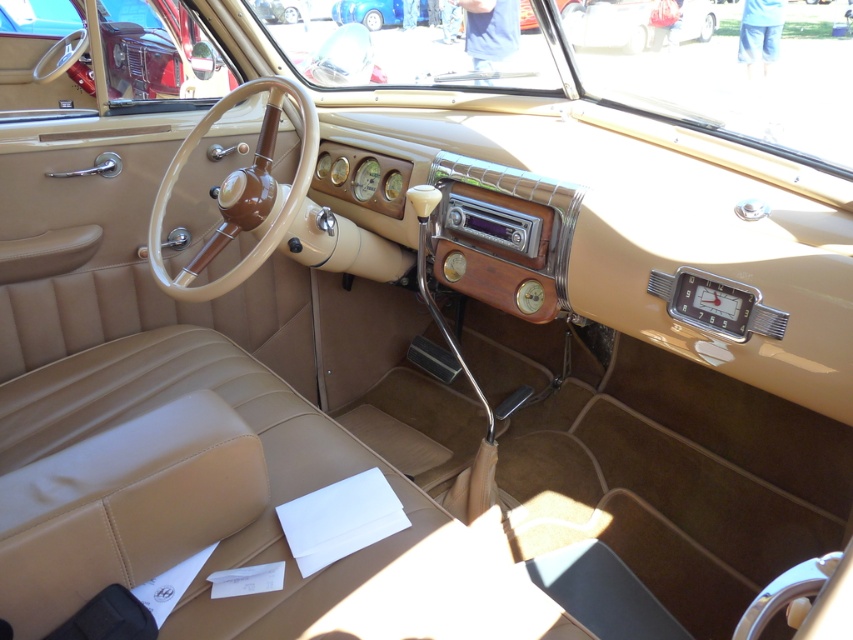
Question: Which point is farther to the camera?

Choices:
 (A) matte wood steering wheel at upper left
 (B) blue metallic car at upper center

Answer: (B)

Question: Is matte wood steering wheel at upper left to the left of blue metallic car at upper center from the viewer's perspective?

Choices:
 (A) yes
 (B) no

Answer: (A)

Question: Does matte wood steering wheel at upper left have a smaller size compared to blue metallic car at upper center?

Choices:
 (A) yes
 (B) no

Answer: (B)

Question: Does matte wood steering wheel at upper left appear on the right side of blue metallic car at upper center?

Choices:
 (A) yes
 (B) no

Answer: (B)

Question: Which point is farther from the camera taking this photo?

Choices:
 (A) (363, 19)
 (B) (4, 84)

Answer: (A)